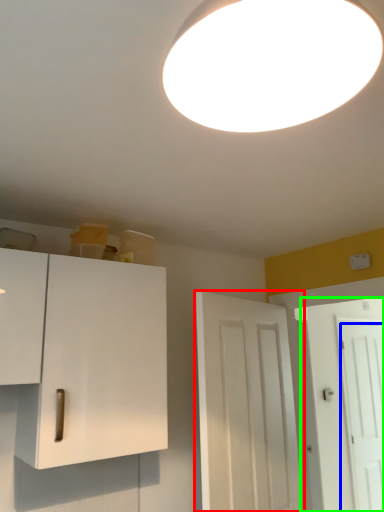
Question: Which is farther away from door (highlighted by a red box)? door (highlighted by a blue box) or door (highlighted by a green box)?

Choices:
 (A) door
 (B) door

Answer: (A)